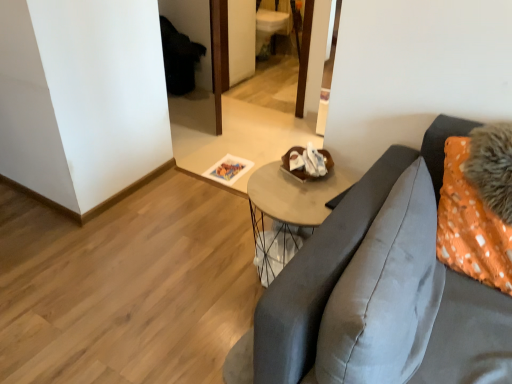
Question: Relative to wooden round table at center, is satin gray pillow at right in front or behind?

Choices:
 (A) front
 (B) behind

Answer: (A)

Question: Looking at their shapes, would you say satin gray pillow at right is wider or thinner than wooden round table at center?

Choices:
 (A) wide
 (B) thin

Answer: (B)

Question: Which of these objects is positioned farthest from the wooden round table at center?

Choices:
 (A) wooden mirror at center
 (B) satin gray pillow at right

Answer: (A)

Question: Considering the real-world distances, which object is farthest from the wooden round table at center?

Choices:
 (A) wooden mirror at center
 (B) satin gray pillow at right

Answer: (A)